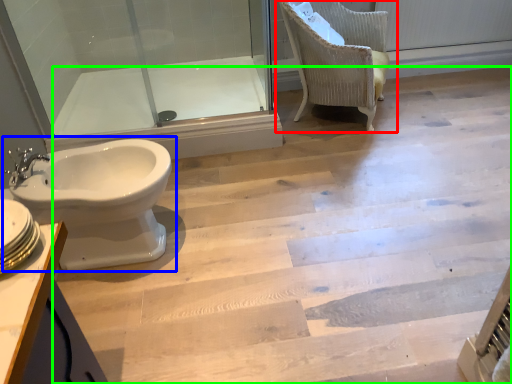
Question: Which is farther away from chair (highlighted by a red box)? toilet (highlighted by a blue box) or stairwell (highlighted by a green box)?

Choices:
 (A) toilet
 (B) stairwell

Answer: (A)